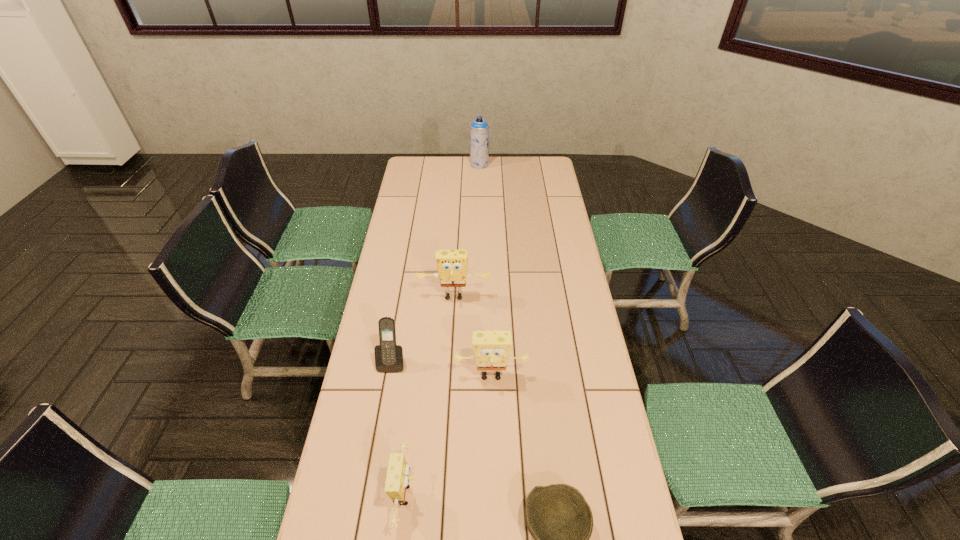
What are the coordinates of `sponge that is at the left edge` in the screenshot? It's located at (452, 265).

The height and width of the screenshot is (540, 960). What are the coordinates of `cellular telephone situated at the left edge` in the screenshot? It's located at 388,356.

Locate an element on the screen. This screenshot has width=960, height=540. free space at the far edge of the desktop is located at coordinates (495, 158).

Find the location of a particular element. This screenshot has height=540, width=960. free region at the left edge of the desktop is located at coordinates (413, 218).

Where is `vacant space at the right edge`? vacant space at the right edge is located at coordinates (555, 274).

The height and width of the screenshot is (540, 960). I want to click on vacant region at the far left corner, so click(422, 178).

Locate an element on the screen. The image size is (960, 540). blank region between the cellular telephone and the tallest object is located at coordinates pyautogui.click(x=436, y=263).

Find the location of a particular element. This screenshot has width=960, height=540. vacant region between the second nearest sponge and the aerosol can is located at coordinates (485, 270).

Where is `vacant space in between the second farthest sponge and the cellular telephone`? The image size is (960, 540). vacant space in between the second farthest sponge and the cellular telephone is located at coordinates (442, 368).

In order to click on free space that is in between the aerosol can and the farthest sponge in this screenshot , I will do `click(467, 231)`.